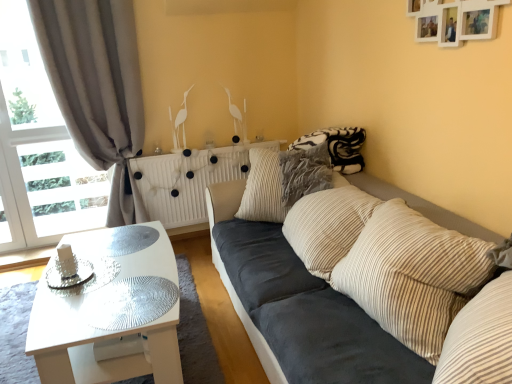
Question: Considering the relative positions of striped corduroy pillow at center, marked as the first pillow in a front-to-back arrangement, and transparent glass table at lower left in the image provided, is striped corduroy pillow at center, marked as the first pillow in a front-to-back arrangement, in front of transparent glass table at lower left?

Choices:
 (A) yes
 (B) no

Answer: (A)

Question: Considering the relative sizes of striped corduroy pillow at center, marked as the first pillow in a front-to-back arrangement, and transparent glass table at lower left in the image provided, is striped corduroy pillow at center, marked as the first pillow in a front-to-back arrangement, shorter than transparent glass table at lower left?

Choices:
 (A) no
 (B) yes

Answer: (A)

Question: Can you confirm if striped corduroy pillow at center, marked as the first pillow in a front-to-back arrangement, is taller than transparent glass table at lower left?

Choices:
 (A) no
 (B) yes

Answer: (B)

Question: Is striped corduroy pillow at center, marked as the first pillow in a front-to-back arrangement, oriented towards transparent glass table at lower left?

Choices:
 (A) no
 (B) yes

Answer: (B)

Question: Is striped corduroy pillow at center, which is the second pillow from back to front, turned away from transparent glass table at lower left?

Choices:
 (A) no
 (B) yes

Answer: (A)

Question: Would you say dark blue fabric couch at center is to the left or to the right of striped corduroy pillow at center, which is the 2th pillow from front to back, in the picture?

Choices:
 (A) right
 (B) left

Answer: (A)

Question: Do you think dark blue fabric couch at center is within striped corduroy pillow at center, which is the 2th pillow from front to back, or outside of it?

Choices:
 (A) inside
 (B) outside

Answer: (B)

Question: From the image's perspective, is dark blue fabric couch at center positioned above or below striped corduroy pillow at center, which is the 2th pillow from front to back?

Choices:
 (A) below
 (B) above

Answer: (A)

Question: From a real-world perspective, relative to striped corduroy pillow at center, which is the 2th pillow from front to back, is dark blue fabric couch at center vertically above or below?

Choices:
 (A) below
 (B) above

Answer: (A)

Question: Considering the relative positions of striped corduroy pillow at center, which is the 1th pillow from back to front, and white textured radiator at center in the image provided, is striped corduroy pillow at center, which is the 1th pillow from back to front, to the left or to the right of white textured radiator at center?

Choices:
 (A) left
 (B) right

Answer: (B)

Question: Is striped corduroy pillow at center, which is the 2th pillow from front to back, wider or thinner than white textured radiator at center?

Choices:
 (A) wide
 (B) thin

Answer: (A)

Question: Looking at the image, does striped corduroy pillow at center, which is the 1th pillow from back to front, seem bigger or smaller compared to white textured radiator at center?

Choices:
 (A) small
 (B) big

Answer: (A)

Question: In the image, is striped corduroy pillow at center, which is the 1th pillow from back to front, positioned in front of or behind white textured radiator at center?

Choices:
 (A) front
 (B) behind

Answer: (A)

Question: Is point (44, 352) closer or farther from the camera than point (378, 331)?

Choices:
 (A) closer
 (B) farther

Answer: (A)

Question: Relative to dark blue fabric couch at center, is white glossy coffee table at lower left in front or behind?

Choices:
 (A) behind
 (B) front

Answer: (A)